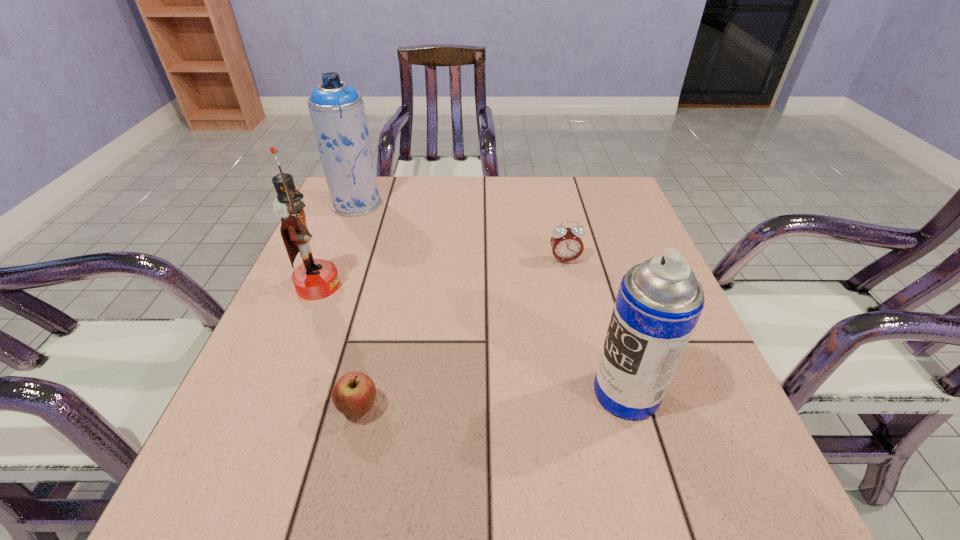
Find the location of a particular element. This screenshot has height=540, width=960. free area in between the third object from left to right and the nutcracker is located at coordinates (339, 347).

Locate an element on the screen. vacant region between the nutcracker and the farther aerosol can is located at coordinates (338, 245).

Locate an element on the screen. The height and width of the screenshot is (540, 960). vacant space in between the apple and the third farthest object is located at coordinates (339, 347).

This screenshot has height=540, width=960. Identify the location of vacant area between the apple and the second shortest object. (462, 335).

Where is `empty space that is in between the nearer aerosol can and the third object from right to left`? empty space that is in between the nearer aerosol can and the third object from right to left is located at coordinates (492, 401).

Locate an element on the screen. free space between the right aerosol can and the third nearest object is located at coordinates (472, 339).

Locate which object ranks second in proximity to the third object from left to right. Please provide its 2D coordinates. Your answer should be formatted as a tuple, i.e. [(x, y)], where the tuple contains the x and y coordinates of a point satisfying the conditions above.

[(659, 302)]

Identify which object is the closest to the third farthest object. Please provide its 2D coordinates. Your answer should be formatted as a tuple, i.e. [(x, y)], where the tuple contains the x and y coordinates of a point satisfying the conditions above.

[(337, 111)]

At what (x,y) coordinates should I click in order to perform the action: click on blank space that satisfies the following two spatial constraints: 1. on the front side of the farthest object; 2. on the front-facing side of the nutcracker. Please return your answer as a coordinate pair (x, y). This screenshot has height=540, width=960. Looking at the image, I should click on (324, 286).

In order to click on vacant area in the image that satisfies the following two spatial constraints: 1. on the front-facing side of the nutcracker; 2. on the left side of the shortest object in this screenshot , I will do `click(268, 409)`.